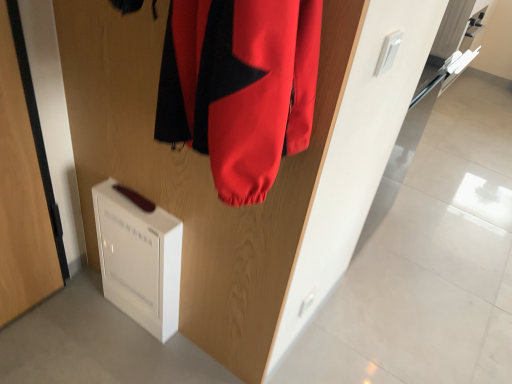
In order to face white matte door at lower left, which is counted as the first door, starting from the left, should I rotate leftwards or rightwards?

A 30.750 degree turn to the left will do.

Identify the location of white plastic air purifier at lower left. This screenshot has height=384, width=512. point(139,257).

The image size is (512, 384). Identify the location of white matte door at lower left, the 2th door positioned from the right. (23, 184).

Measure the distance from white plastic air purifier at lower left to wooden door at center, placed as the 1th door when sorted from right to left.

white plastic air purifier at lower left and wooden door at center, placed as the 1th door when sorted from right to left, are 7.21 inches apart.

Where is `appliance behind the wooden door at center, placed as the 1th door when sorted from right to left`? appliance behind the wooden door at center, placed as the 1th door when sorted from right to left is located at coordinates (139, 257).

What's the angular difference between white plastic air purifier at lower left and wooden door at center, placed as the 1th door when sorted from right to left,'s facing directions?

Result: 0.00117 degrees.

Based on the photo, is white plastic air purifier at lower left looking in the opposite direction of wooden door at center, placed as the 1th door when sorted from right to left?

Correct, white plastic air purifier at lower left is looking away from wooden door at center, placed as the 1th door when sorted from right to left.

In the scene shown: Considering the relative sizes of white matte door at lower left, which is counted as the first door, starting from the left, and wooden door at center, the 2th door in the left-to-right sequence, in the image provided, is white matte door at lower left, which is counted as the first door, starting from the left, thinner than wooden door at center, the 2th door in the left-to-right sequence,?

Incorrect, the width of white matte door at lower left, which is counted as the first door, starting from the left, is not less than that of wooden door at center, the 2th door in the left-to-right sequence.

Considering the sizes of objects white matte door at lower left, the 2th door positioned from the right, and wooden door at center, the 2th door in the left-to-right sequence, in the image provided, who is bigger, white matte door at lower left, the 2th door positioned from the right, or wooden door at center, the 2th door in the left-to-right sequence,?

white matte door at lower left, the 2th door positioned from the right.

Locate an element on the screen. This screenshot has width=512, height=384. door that is above the wooden door at center, the 2th door in the left-to-right sequence (from the image's perspective) is located at coordinates (23, 184).

Between white matte door at lower left, which is counted as the first door, starting from the left, and wooden door at center, placed as the 1th door when sorted from right to left, which one has less height?

white matte door at lower left, which is counted as the first door, starting from the left, is shorter.

Between point (225, 346) and point (38, 221), which one is positioned in front?

The point (38, 221) is closer.

Can you confirm if wooden door at center, placed as the 1th door when sorted from right to left, is thinner than white matte door at lower left, the 2th door positioned from the right?

Indeed, wooden door at center, placed as the 1th door when sorted from right to left, has a lesser width compared to white matte door at lower left, the 2th door positioned from the right.

From a real-world perspective, between wooden door at center, placed as the 1th door when sorted from right to left, and white matte door at lower left, the 2th door positioned from the right, who is vertically higher?

wooden door at center, placed as the 1th door when sorted from right to left.

Could white matte door at lower left, which is counted as the first door, starting from the left, be considered to be inside wooden door at center, placed as the 1th door when sorted from right to left?

No.

From the picture: Which point is more forward, (85, 93) or (112, 179)?

The point (85, 93) is more forward.

Is wooden door at center, placed as the 1th door when sorted from right to left, beside white plastic air purifier at lower left?

No, wooden door at center, placed as the 1th door when sorted from right to left, is not next to white plastic air purifier at lower left.

Is white plastic air purifier at lower left at the back of wooden door at center, placed as the 1th door when sorted from right to left?

Yes, wooden door at center, placed as the 1th door when sorted from right to left, is positioned with its back facing white plastic air purifier at lower left.

Considering the relative sizes of wooden door at center, the 2th door in the left-to-right sequence, and white plastic air purifier at lower left in the image provided, is wooden door at center, the 2th door in the left-to-right sequence, smaller than white plastic air purifier at lower left?

No, wooden door at center, the 2th door in the left-to-right sequence, is not smaller than white plastic air purifier at lower left.

Is white matte door at lower left, the 2th door positioned from the right, positioned far away from white plastic air purifier at lower left?

No, there isn't a large distance between white matte door at lower left, the 2th door positioned from the right, and white plastic air purifier at lower left.

Considering the relative sizes of white matte door at lower left, which is counted as the first door, starting from the left, and white plastic air purifier at lower left in the image provided, is white matte door at lower left, which is counted as the first door, starting from the left, bigger than white plastic air purifier at lower left?

Yes, white matte door at lower left, which is counted as the first door, starting from the left, is bigger than white plastic air purifier at lower left.

From the image's perspective, would you say white matte door at lower left, which is counted as the first door, starting from the left, is shown under white plastic air purifier at lower left?

No.

Locate an element on the screen. This screenshot has width=512, height=384. the 2nd door positioned above the white plastic air purifier at lower left (from the image's perspective) is located at coordinates (23, 184).

Is white plastic air purifier at lower left spatially inside white matte door at lower left, which is counted as the first door, starting from the left, or outside of it?

white plastic air purifier at lower left is not inside white matte door at lower left, which is counted as the first door, starting from the left, it's outside.

How far apart are white plastic air purifier at lower left and white matte door at lower left, the 2th door positioned from the right?

white plastic air purifier at lower left is 30.28 centimeters away from white matte door at lower left, the 2th door positioned from the right.

Which is behind, point (140, 298) or point (22, 92)?

The point (140, 298) is more distant.

Are white plastic air purifier at lower left and white matte door at lower left, which is counted as the first door, starting from the left, making contact?

No, white plastic air purifier at lower left is not beside white matte door at lower left, which is counted as the first door, starting from the left.

Identify the location of appliance behind the wooden door at center, placed as the 1th door when sorted from right to left. This screenshot has width=512, height=384. (139, 257).

You are a GUI agent. You are given a task and a screenshot of the screen. Output one action in this format:
    pyautogui.click(x=<x>, y=<y>)
    Task: Click on the door that is under the wooden door at center, the 2th door in the left-to-right sequence (from a real-world perspective)
    The height and width of the screenshot is (384, 512).
    Given the screenshot: What is the action you would take?
    pyautogui.click(x=23, y=184)

Which object lies nearer to the anchor point wooden door at center, the 2th door in the left-to-right sequence, white plastic air purifier at lower left or white matte door at lower left, which is counted as the first door, starting from the left?

white plastic air purifier at lower left lies closer to wooden door at center, the 2th door in the left-to-right sequence, than the other object.

Based on their spatial positions, is white matte door at lower left, the 2th door positioned from the right, or wooden door at center, the 2th door in the left-to-right sequence, further from white plastic air purifier at lower left?

Based on the image, white matte door at lower left, the 2th door positioned from the right, appears to be further to white plastic air purifier at lower left.

Consider the image. Estimate the real-world distances between objects in this image. Which object is further from wooden door at center, placed as the 1th door when sorted from right to left, white matte door at lower left, the 2th door positioned from the right, or white plastic air purifier at lower left?

white matte door at lower left, the 2th door positioned from the right, is positioned further to the anchor wooden door at center, placed as the 1th door when sorted from right to left.

Looking at the image, which one is located further to white matte door at lower left, which is counted as the first door, starting from the left, white plastic air purifier at lower left or wooden door at center, placed as the 1th door when sorted from right to left?

The object further to white matte door at lower left, which is counted as the first door, starting from the left, is wooden door at center, placed as the 1th door when sorted from right to left.

Which object lies further to the anchor point white matte door at lower left, which is counted as the first door, starting from the left, wooden door at center, placed as the 1th door when sorted from right to left, or white plastic air purifier at lower left?

wooden door at center, placed as the 1th door when sorted from right to left, is further to white matte door at lower left, which is counted as the first door, starting from the left.

When comparing their distances from white plastic air purifier at lower left, does wooden door at center, the 2th door in the left-to-right sequence, or white matte door at lower left, the 2th door positioned from the right, seem further?

white matte door at lower left, the 2th door positioned from the right, is further to white plastic air purifier at lower left.

Locate an element on the screen. door located between wooden door at center, placed as the 1th door when sorted from right to left, and white plastic air purifier at lower left in the depth direction is located at coordinates (23, 184).